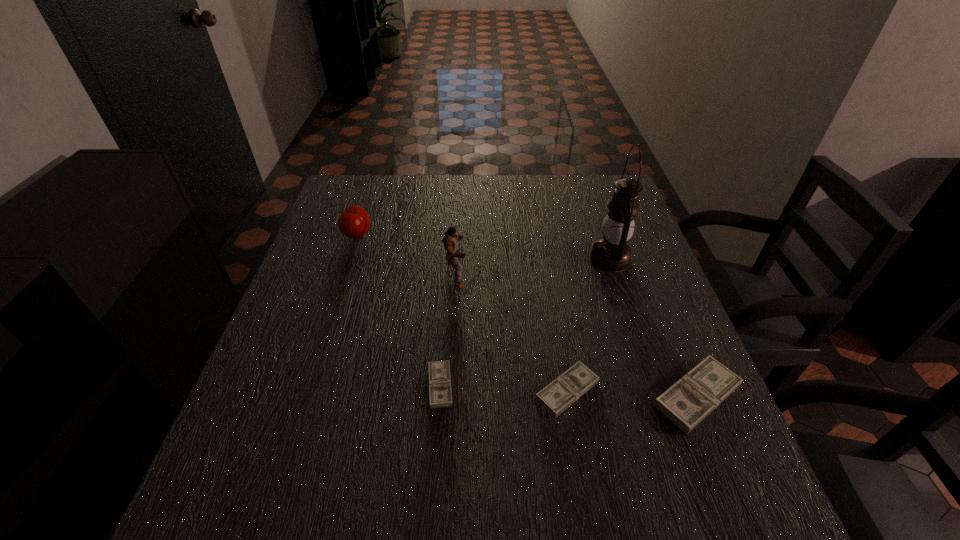
The height and width of the screenshot is (540, 960). I want to click on free space located on the left of the shortest money, so click(367, 385).

Where is `vacant position located 0.190m on the back of the second money from right to left`? This screenshot has width=960, height=540. vacant position located 0.190m on the back of the second money from right to left is located at coordinates (552, 300).

Identify the location of free space located 0.160m on the left of the tallest money. The height and width of the screenshot is (540, 960). (568, 396).

The height and width of the screenshot is (540, 960). I want to click on vacant area located on the front of the fourth shortest object, so click(341, 282).

The image size is (960, 540). Identify the location of vacant space situated on the front-facing side of the puncher. (618, 276).

Where is `free space located on the left of the oil lamp`? free space located on the left of the oil lamp is located at coordinates (556, 259).

This screenshot has width=960, height=540. In order to click on object that is at the left edge in this screenshot , I will do `click(354, 222)`.

Locate an element on the screen. This screenshot has height=540, width=960. money present at the right edge is located at coordinates (692, 398).

At what (x,y) coordinates should I click in order to perform the action: click on oil lamp that is at the right edge. Please return your answer as a coordinate pair (x, y). Looking at the image, I should click on (612, 254).

The width and height of the screenshot is (960, 540). I want to click on object at the near right corner, so click(692, 398).